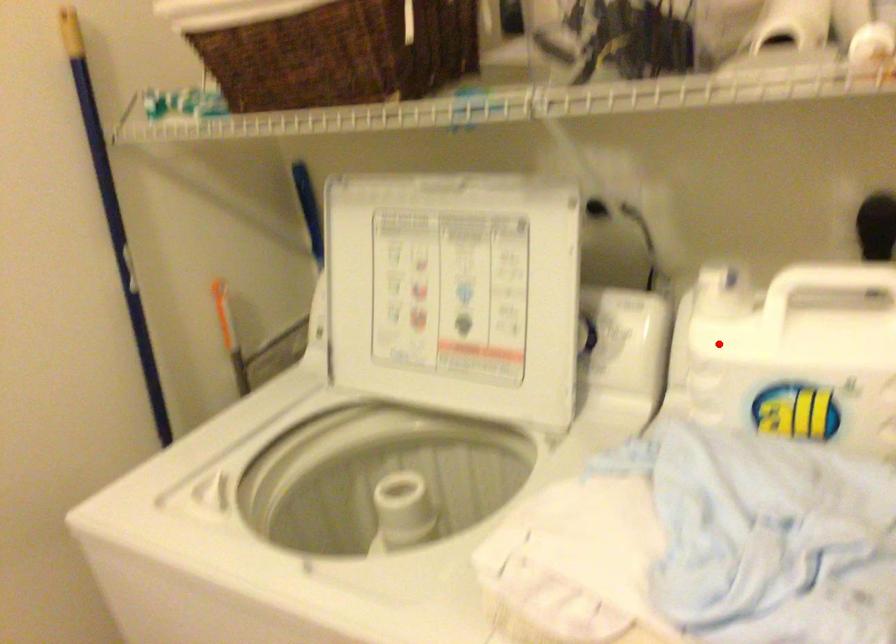
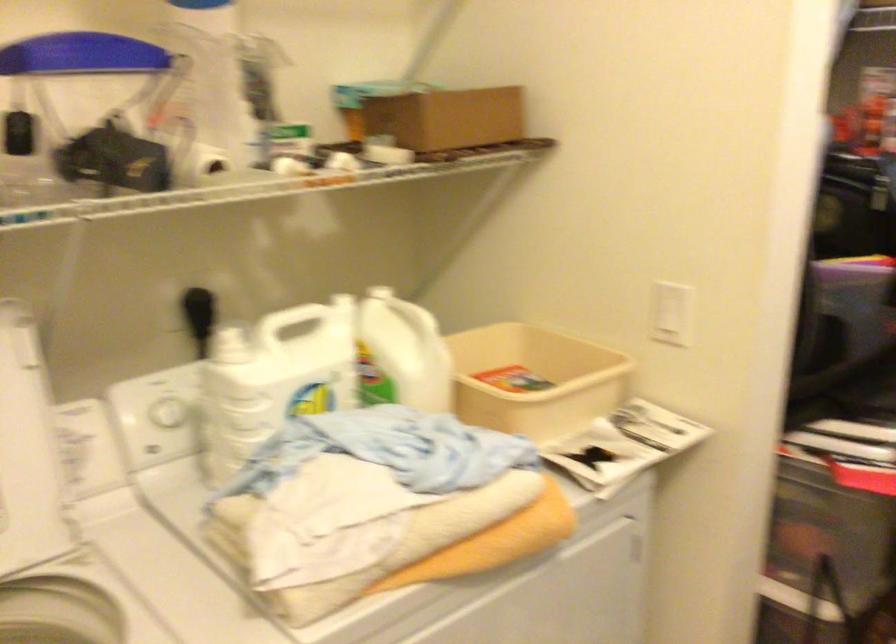
Locate, in the second image, the point that corresponds to the highlighted location in the first image.

(168, 412)